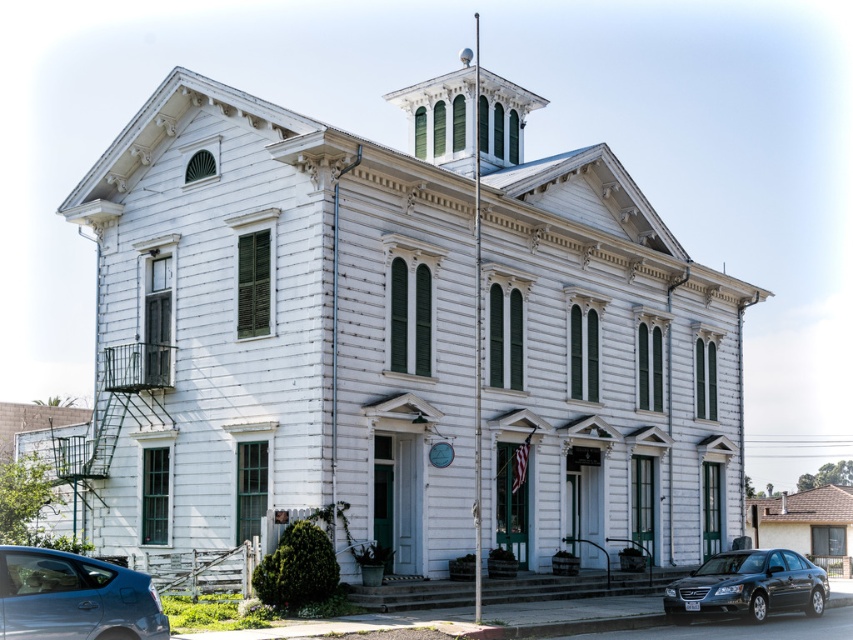
You are a delivery person who needs to park your truck between the metallic blue sedan at lower left and the shiny black sedan at lower right. Your truck is 10 meters long. Can you fit your truck between them without moving either car?

The distance between the metallic blue sedan at lower left and the shiny black sedan at lower right is 23.65 meters. Since your truck is only 10 meters long, there is sufficient space to park it between them without needing to move either car.

You are a delivery driver who needs to park your truck, which is 2 meters wide, between the metallic blue sedan at lower left and the shiny black sedan at lower right. Can you fit your truck between them?

The metallic blue sedan at lower left has a lesser width compared to shiny black sedan at lower right, so the space between them may be sufficient for the truck. However, without knowing the exact distance between the two sedans, it is impossible to confirm if the truck can fit.